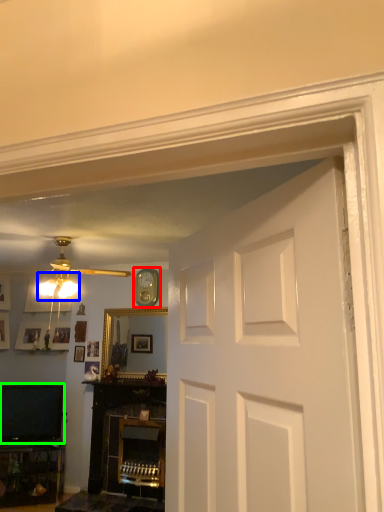
Question: Which is farther away from clock (highlighted by a red box)? lamp (highlighted by a blue box) or television (highlighted by a green box)?

Choices:
 (A) lamp
 (B) television

Answer: (B)